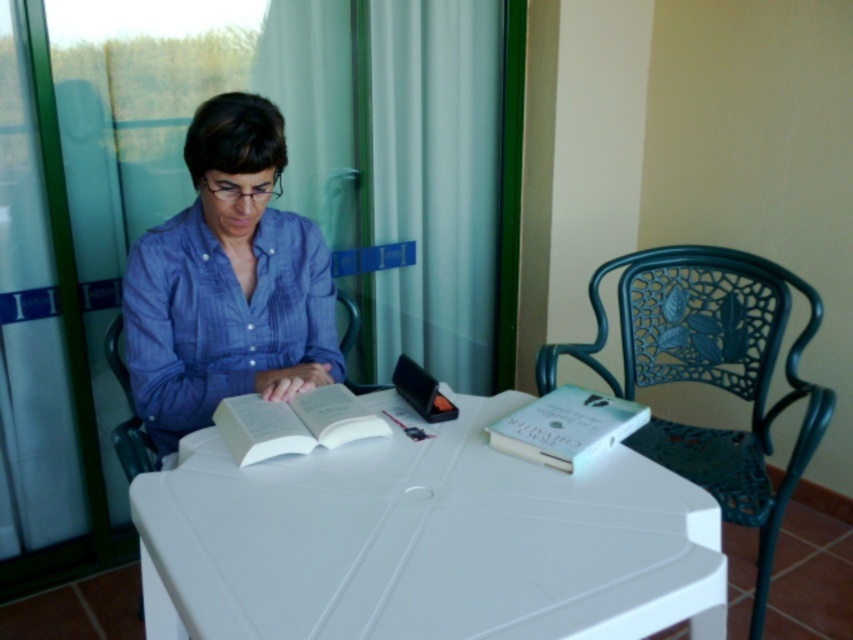
Who is more distant from viewer, (173, 291) or (103, 344)?

Positioned behind is point (103, 344).

Is blue cotton shirt at center positioned at the back of metallic blue chair at left?

No, blue cotton shirt at center is in front of metallic blue chair at left.

Describe the element at coordinates (227, 282) in the screenshot. This screenshot has height=640, width=853. I see `blue cotton shirt at center` at that location.

Identify the location of blue cotton shirt at center. This screenshot has width=853, height=640. (227, 282).

Between white matte book at lower right and metallic blue chair at left, which one has more height?

metallic blue chair at left is taller.

Find the location of a particular element. white matte book at lower right is located at coordinates (567, 428).

Does white sheer curtain at upper center have a greater width compared to green wrought iron chair at right?

No.

Can you confirm if white sheer curtain at upper center is smaller than green wrought iron chair at right?

Incorrect, white sheer curtain at upper center is not smaller in size than green wrought iron chair at right.

This screenshot has width=853, height=640. Describe the element at coordinates (399, 161) in the screenshot. I see `white sheer curtain at upper center` at that location.

Locate an element on the screen. white sheer curtain at upper center is located at coordinates (399, 161).